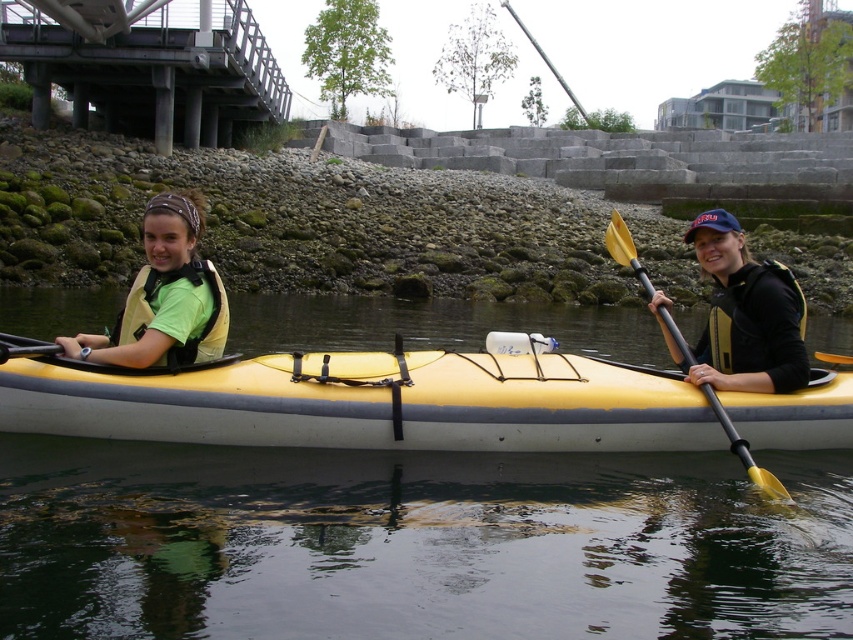
You are a photographer trying to capture the matte black kayak at right. What are the coordinates where you should aim your camera?

The coordinates for the matte black kayak at right are at point (744, 316).

You are standing on the shore of the lake and see the image. The coordinates of the kayak are given as point (744, 316). If you want to reach the kayak, which direction should you walk from your current position?

The matte black kayak at right is located at point (744, 316). To reach it, you should walk towards the coordinates provided, which would be the direction where the kayak is positioned relative to your current location on the shore.